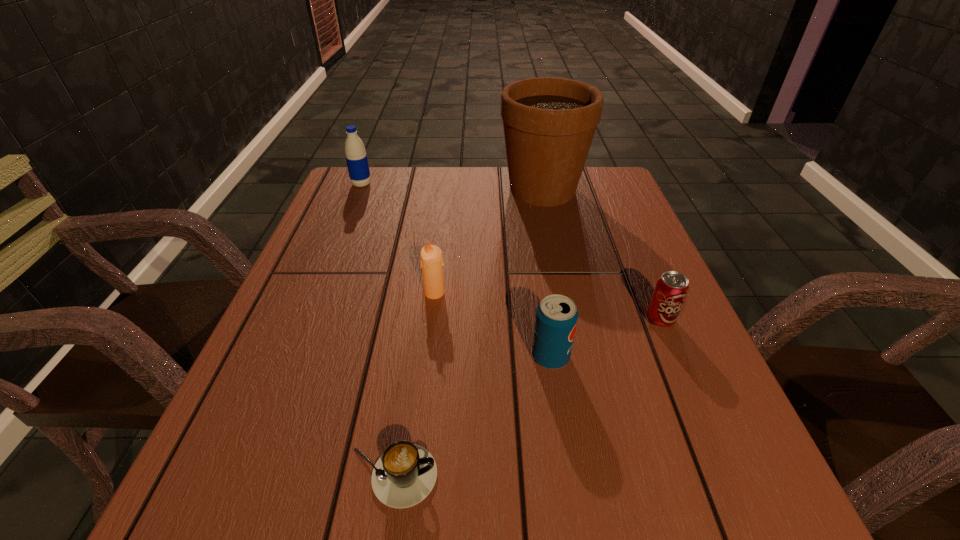
Find the location of a particular element. This screenshot has width=960, height=540. vacant region located 0.050m on the front of the tallest object is located at coordinates (550, 225).

Locate an element on the screen. free spot located 0.270m on the right of the water bottle is located at coordinates (466, 184).

The image size is (960, 540). What are the coordinates of `vacant region located 0.300m on the right of the candle` in the screenshot? It's located at (588, 293).

This screenshot has width=960, height=540. I want to click on free space located 0.250m on the back of the left soda, so click(536, 259).

The image size is (960, 540). I want to click on blank space located on the left of the rightmost object, so click(539, 320).

I want to click on vacant area situated 0.250m with the handle on the side of the shortest object, so click(612, 476).

I want to click on flowerpot that is at the far edge, so click(x=549, y=123).

You are a GUI agent. You are given a task and a screenshot of the screen. Output one action in this format:
    pyautogui.click(x=<x>, y=<y>)
    Task: Click on the water bottle present at the far edge
    The width and height of the screenshot is (960, 540).
    Given the screenshot: What is the action you would take?
    pyautogui.click(x=355, y=153)

Image resolution: width=960 pixels, height=540 pixels. In order to click on object positioned at the near edge in this screenshot , I will do `click(405, 474)`.

The width and height of the screenshot is (960, 540). I want to click on object at the left edge, so click(x=355, y=153).